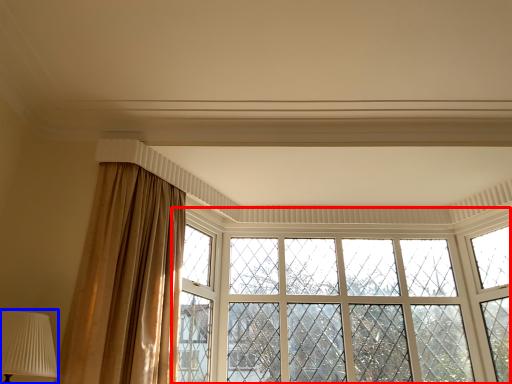
Question: Which of the following is the closest to the observer, window (highlighted by a red box) or table lamp (highlighted by a blue box)?

Choices:
 (A) window
 (B) table lamp

Answer: (B)